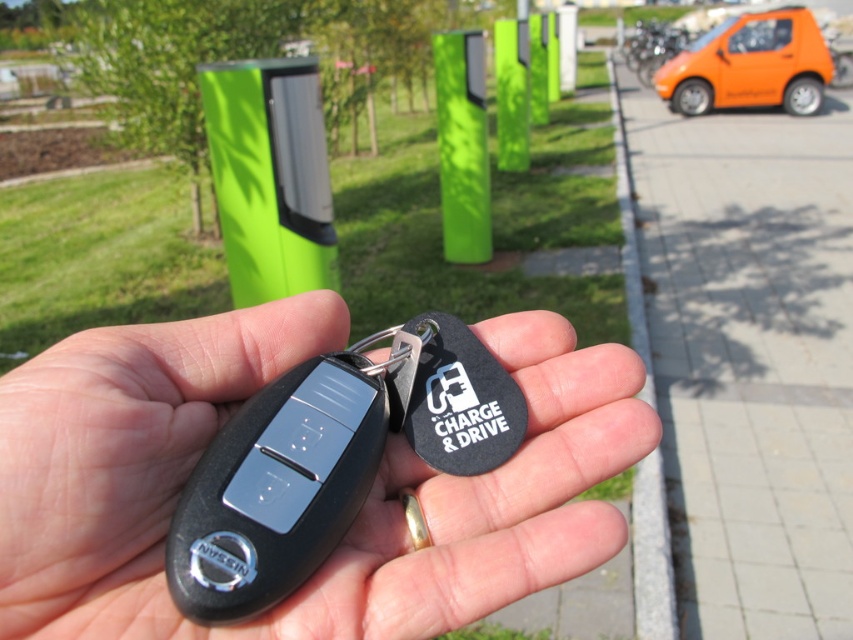
You are a delivery robot with a 12 inch wide package. You need to move from the point marked at (368, 552) to the orange car parked on the right. Is there enough space between the lime green cylindrical structures to move through?

The distance between the point marked at (368, 552) and the orange car parked on the right is 17.74 inches. Since the package is 12 inches wide, there is enough space to move through as 17.74 inches is greater than 12 inches.

You are a delivery person who needs to place a black matte key fob at center into a storage box that can only hold items narrower than the orange matte car at right. Can the key fob fit?

The black matte key fob at center is narrower than the orange matte car at right, so it can fit into the storage box.

You are a delivery person who needs to park your delivery van between the orange matte car at right and the green matte pole at center. Is there enough space between them to park your van?

The orange matte car at right is positioned on the right side of green matte pole at center, so there is space between them. However, the description does not provide specific measurements of the distance between the two objects. Without knowing the exact distance or the size of the van, it is impossible to determine if there is enough space to park the van between them.